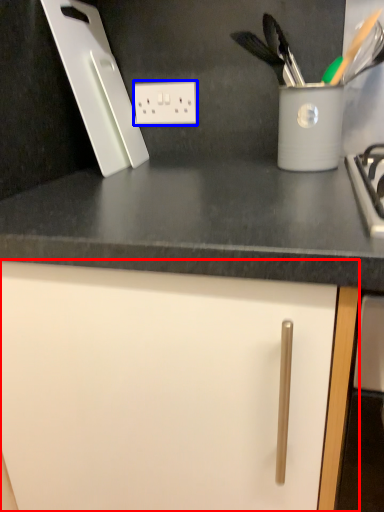
Question: Which object is further to the camera taking this photo, cabinetry (highlighted by a red box) or electric outlet (highlighted by a blue box)?

Choices:
 (A) cabinetry
 (B) electric outlet

Answer: (B)